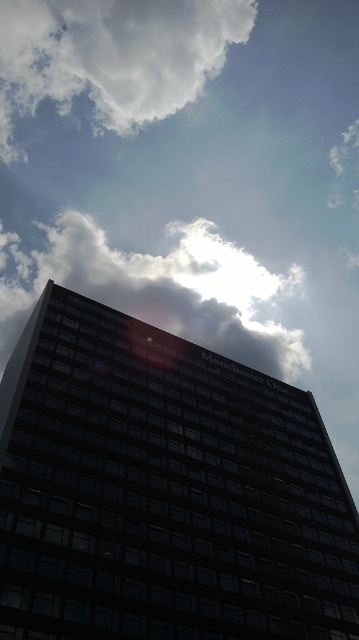
You are looking up at the building and notice two white fluffy clouds in the sky. Which cloud is higher in the sky between the white fluffy cloud at upper left and the white fluffy cloud at upper center?

The white fluffy cloud at upper left is higher in the sky than the white fluffy cloud at upper center because it is positioned above it.

You are a drone operator trying to navigate between two white fluffy clouds in the sky. You need to fly your drone from the white fluffy cloud at upper left to the white fluffy cloud at upper center. Which direction should you fly the drone to move away from the viewer?

To move away from the viewer, you should fly the drone towards the white fluffy cloud at upper center since it is farther away than the white fluffy cloud at upper left.